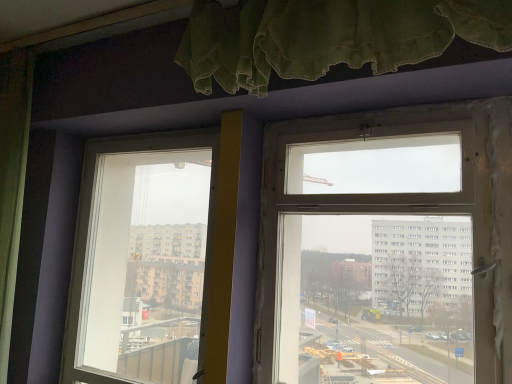
Question: In which direction should I rotate to look at clear glass window at upper center, which ranks as the 1th window in front-to-back order?

Choices:
 (A) left
 (B) right

Answer: (B)

Question: From the image's perspective, is transparent glass window at center, positioned as the first window in back-to-front order, above clear glass window at upper center, which ranks as the 1th window in front-to-back order?

Choices:
 (A) no
 (B) yes

Answer: (A)

Question: Is transparent glass window at center, marked as the first window in a left-to-right arrangement, surrounding clear glass window at upper center, which is the 1th window from right to left?

Choices:
 (A) no
 (B) yes

Answer: (A)

Question: Considering the relative sizes of transparent glass window at center, acting as the second window starting from the front, and clear glass window at upper center, which ranks as the 1th window in front-to-back order, in the image provided, is transparent glass window at center, acting as the second window starting from the front, shorter than clear glass window at upper center, which ranks as the 1th window in front-to-back order,?

Choices:
 (A) no
 (B) yes

Answer: (A)

Question: Is transparent glass window at center, acting as the second window starting from the front, at the right side of clear glass window at upper center, which is the 1th window from right to left?

Choices:
 (A) no
 (B) yes

Answer: (A)

Question: From a real-world perspective, is transparent glass window at center, marked as the first window in a left-to-right arrangement, under clear glass window at upper center, which is the 1th window from right to left?

Choices:
 (A) no
 (B) yes

Answer: (B)

Question: Does transparent glass window at center, positioned as the first window in back-to-front order, have a smaller size compared to clear glass window at upper center, which is the 1th window from right to left?

Choices:
 (A) yes
 (B) no

Answer: (B)

Question: Does clear glass window at upper center, which ranks as the 1th window in front-to-back order, come in front of transparent glass window at center, acting as the second window starting from the front?

Choices:
 (A) yes
 (B) no

Answer: (A)

Question: From a real-world perspective, is clear glass window at upper center, which is the 2th window in left-to-right order, beneath transparent glass window at center, marked as the first window in a left-to-right arrangement?

Choices:
 (A) yes
 (B) no

Answer: (B)

Question: Is clear glass window at upper center, acting as the 2th window starting from the back, completely or partially outside of transparent glass window at center, positioned as the 2th window in right-to-left order?

Choices:
 (A) yes
 (B) no

Answer: (A)

Question: Is clear glass window at upper center, which ranks as the 1th window in front-to-back order, thinner than transparent glass window at center, marked as the first window in a left-to-right arrangement?

Choices:
 (A) no
 (B) yes

Answer: (B)

Question: From a real-world perspective, is clear glass window at upper center, which ranks as the 1th window in front-to-back order, positioned over transparent glass window at center, marked as the first window in a left-to-right arrangement, based on gravity?

Choices:
 (A) no
 (B) yes

Answer: (B)

Question: Considering the relative positions of clear glass window at upper center, which ranks as the 1th window in front-to-back order, and transparent glass window at center, positioned as the 2th window in right-to-left order, in the image provided, is clear glass window at upper center, which ranks as the 1th window in front-to-back order, to the right of transparent glass window at center, positioned as the 2th window in right-to-left order, from the viewer's perspective?

Choices:
 (A) no
 (B) yes

Answer: (B)

Question: From a real-world perspective, relative to transparent glass window at center, acting as the second window starting from the front, is clear glass window at upper center, which is the 1th window from right to left, vertically above or below?

Choices:
 (A) above
 (B) below

Answer: (A)